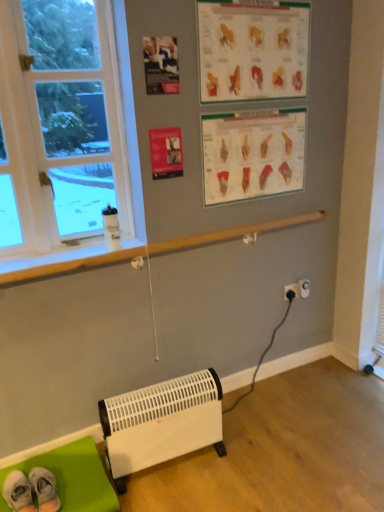
Question: Is matte paper poster at upper center facing away from white fabric socks at lower left?

Choices:
 (A) yes
 (B) no

Answer: (B)

Question: Is the depth of matte paper poster at upper center greater than that of white fabric socks at lower left?

Choices:
 (A) no
 (B) yes

Answer: (B)

Question: Is matte paper poster at upper center shorter than white fabric socks at lower left?

Choices:
 (A) no
 (B) yes

Answer: (A)

Question: Can you confirm if matte paper poster at upper center is positioned to the left of white fabric socks at lower left?

Choices:
 (A) no
 (B) yes

Answer: (A)

Question: Considering the relative positions of matte paper poster at upper center and white fabric socks at lower left in the image provided, is matte paper poster at upper center in front of white fabric socks at lower left?

Choices:
 (A) yes
 (B) no

Answer: (B)

Question: From a real-world perspective, is matte paper poster at upper center over white fabric socks at lower left?

Choices:
 (A) yes
 (B) no

Answer: (A)

Question: Does matte paper poster at upper center have a lesser height compared to white plastic window at left?

Choices:
 (A) yes
 (B) no

Answer: (A)

Question: From a real-world perspective, does matte paper poster at upper center sit lower than white plastic window at left?

Choices:
 (A) yes
 (B) no

Answer: (B)

Question: Does matte paper poster at upper center lie behind white plastic window at left?

Choices:
 (A) yes
 (B) no

Answer: (A)

Question: Considering the relative sizes of matte paper poster at upper center and white plastic window at left in the image provided, is matte paper poster at upper center wider than white plastic window at left?

Choices:
 (A) no
 (B) yes

Answer: (A)

Question: Does matte paper poster at upper center turn towards white plastic window at left?

Choices:
 (A) no
 (B) yes

Answer: (A)

Question: Considering the relative sizes of matte paper poster at upper center and white plastic window at left in the image provided, is matte paper poster at upper center thinner than white plastic window at left?

Choices:
 (A) yes
 (B) no

Answer: (A)

Question: Could you tell me if green fabric mat at lower left is facing matte paper poster at upper center?

Choices:
 (A) yes
 (B) no

Answer: (B)